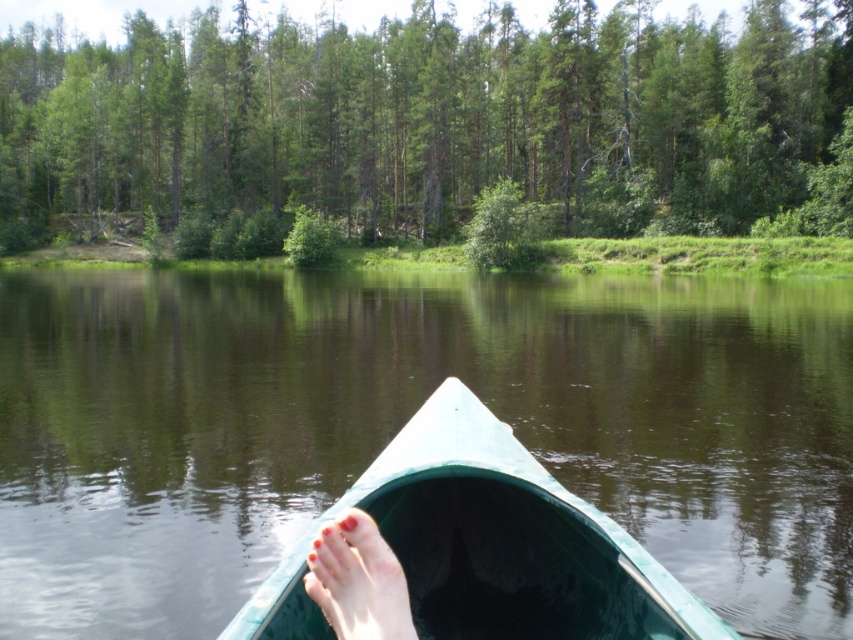
You are planning to place a small floating decoration on the water surface between the green smooth water at center and the green plastic boat at center. Based on the scene description, can you determine which area has more space to accommodate the decoration?

The green smooth water at center is wider than the green plastic boat at center, so the area around the green smooth water at center has more space to place the decoration.

You are in a canoe and want to paddle towards the green leafy tree at upper center. Which direction should you go relative to the green smooth water at center?

The green smooth water at center is to the right of the green leafy tree at upper center, so you should paddle to the left relative to the green smooth water at center to reach the tree.

You are in a canoe and looking forward. You see the green smooth water at center and the green leafy tree at upper center. Which one appears smaller in size?

The green smooth water at center appears smaller in size compared to the green leafy tree at upper center.